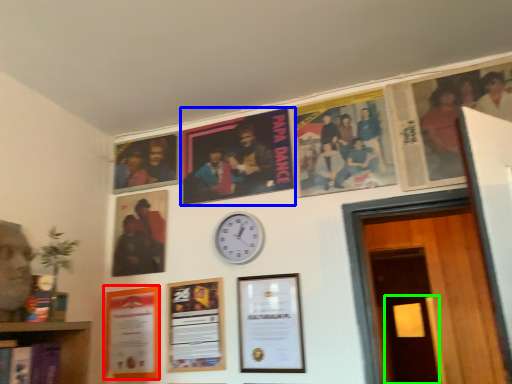
Question: Considering the real-world distances, which object is farthest from picture frame (highlighted by a red box)? poster (highlighted by a blue box) or door (highlighted by a green box)?

Choices:
 (A) poster
 (B) door

Answer: (B)